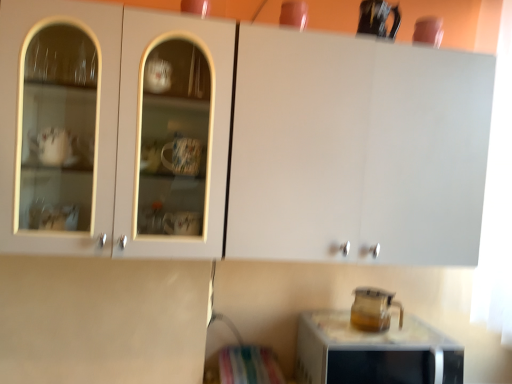
What do you see at coordinates (373, 309) in the screenshot? The image size is (512, 384). I see `transparent glass pitcher at lower right` at bounding box center [373, 309].

You are a GUI agent. You are given a task and a screenshot of the screen. Output one action in this format:
    pyautogui.click(x=<x>, y=<y>)
    Task: Click on the transparent glass pitcher at lower right
    This screenshot has height=384, width=512.
    Given the screenshot: What is the action you would take?
    pyautogui.click(x=373, y=309)

Could you tell me if matte white cabinet at upper center is turned towards transparent glass pitcher at lower right?

No, matte white cabinet at upper center is not aimed at transparent glass pitcher at lower right.

From a real-world perspective, is matte white cabinet at upper center positioned above or below transparent glass pitcher at lower right?

Clearly, from a real-world perspective, matte white cabinet at upper center is above transparent glass pitcher at lower right.

Which is in front, matte white cabinet at upper center or transparent glass pitcher at lower right?

matte white cabinet at upper center is more forward.

Which of these two, matte white cabinet at upper center or transparent glass pitcher at lower right, is smaller?

Smaller between the two is transparent glass pitcher at lower right.

Based on the photo, relative to transparent glass pitcher at lower right, is transparent glass pitcher at lower right in front or behind?

transparent glass pitcher at lower right is in front of transparent glass pitcher at lower right.

From a real-world perspective, is transparent glass pitcher at lower right located higher than transparent glass pitcher at lower right?

No, from a real-world perspective, transparent glass pitcher at lower right is not over transparent glass pitcher at lower right

Looking at this image, how different are the orientations of transparent glass pitcher at lower right and transparent glass pitcher at lower right in degrees?

They differ by 0.000258 degrees in their facing directions.

Is transparent glass pitcher at lower right wider or thinner than transparent glass pitcher at lower right?

Clearly, transparent glass pitcher at lower right has more width compared to transparent glass pitcher at lower right.

Is matte white cabinet at upper center thinner than transparent glass pitcher at lower right?

Correct, the width of matte white cabinet at upper center is less than that of transparent glass pitcher at lower right.

Is point (381, 175) closer to camera compared to point (441, 335)?

Yes, point (381, 175) is closer to viewer.

How far apart are matte white cabinet at upper center and transparent glass pitcher at lower right?

matte white cabinet at upper center is 22.95 inches from transparent glass pitcher at lower right.

Could you tell me if matte white cabinet at upper center is facing transparent glass pitcher at lower right?

No, matte white cabinet at upper center is not facing towards transparent glass pitcher at lower right.

Which is more to the right, transparent glass pitcher at lower right or transparent glass pitcher at lower right?

transparent glass pitcher at lower right.

Is transparent glass pitcher at lower right looking in the opposite direction of transparent glass pitcher at lower right?

No, transparent glass pitcher at lower right is not facing away from transparent glass pitcher at lower right.

Based on the photo, measure the distance between transparent glass pitcher at lower right and transparent glass pitcher at lower right.

transparent glass pitcher at lower right is 5.58 inches away from transparent glass pitcher at lower right.

Which of these two, transparent glass pitcher at lower right or transparent glass pitcher at lower right, stands shorter?

transparent glass pitcher at lower right.

Could matte white cabinet at upper center be considered to be inside transparent glass pitcher at lower right?

No, matte white cabinet at upper center is not inside transparent glass pitcher at lower right.

From the image's perspective, is transparent glass pitcher at lower right above or below matte white cabinet at upper center?

Clearly, from the image's perspective, transparent glass pitcher at lower right is below matte white cabinet at upper center.

Which object is further away from the camera taking this photo, transparent glass pitcher at lower right or matte white cabinet at upper center?

Positioned behind is transparent glass pitcher at lower right.

How many degrees apart are the facing directions of transparent glass pitcher at lower right and matte white cabinet at upper center?

They differ by 2 degrees in their facing directions.

Does transparent glass pitcher at lower right have a smaller size compared to matte white cabinet at upper center?

Yes, transparent glass pitcher at lower right is smaller than matte white cabinet at upper center.

From the image's perspective, is transparent glass pitcher at lower right located above matte white cabinet at upper center?

No, from the image's perspective, transparent glass pitcher at lower right is not on top of matte white cabinet at upper center.

Would you say transparent glass pitcher at lower right is to the left or to the right of matte white cabinet at upper center in the picture?

From the image, it's evident that transparent glass pitcher at lower right is to the right of matte white cabinet at upper center.

This screenshot has height=384, width=512. In order to click on cabinetry in front of the transparent glass pitcher at lower right in this screenshot , I will do `click(300, 141)`.

Where is `appliance lying behind the transparent glass pitcher at lower right`? The width and height of the screenshot is (512, 384). appliance lying behind the transparent glass pitcher at lower right is located at coordinates (373, 309).

Looking at the image, which one is located further to transparent glass pitcher at lower right, matte white cabinet at upper center or transparent glass pitcher at lower right?

matte white cabinet at upper center is positioned further to the anchor transparent glass pitcher at lower right.

Looking at the image, which one is located further to transparent glass pitcher at lower right, transparent glass pitcher at lower right or matte white cabinet at upper center?

Based on the image, matte white cabinet at upper center appears to be further to transparent glass pitcher at lower right.

Looking at the image, which one is located closer to matte white cabinet at upper center, transparent glass pitcher at lower right or transparent glass pitcher at lower right?

transparent glass pitcher at lower right.

Looking at the image, which one is located further to transparent glass pitcher at lower right, matte white cabinet at upper center or transparent glass pitcher at lower right?

matte white cabinet at upper center is further to transparent glass pitcher at lower right.

Estimate the real-world distances between objects in this image. Which object is closer to transparent glass pitcher at lower right, transparent glass pitcher at lower right or matte white cabinet at upper center?

Among the two, transparent glass pitcher at lower right is located nearer to transparent glass pitcher at lower right.

Which object lies nearer to the anchor point matte white cabinet at upper center, transparent glass pitcher at lower right or transparent glass pitcher at lower right?

Among the two, transparent glass pitcher at lower right is located nearer to matte white cabinet at upper center.

This screenshot has height=384, width=512. I want to click on appliance between matte white cabinet at upper center and transparent glass pitcher at lower right from top to bottom, so click(x=373, y=309).